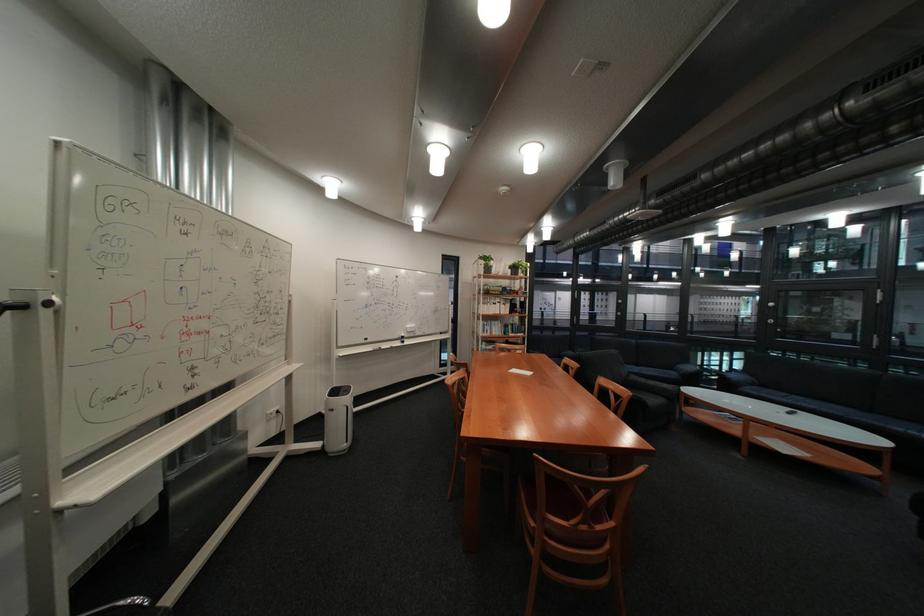
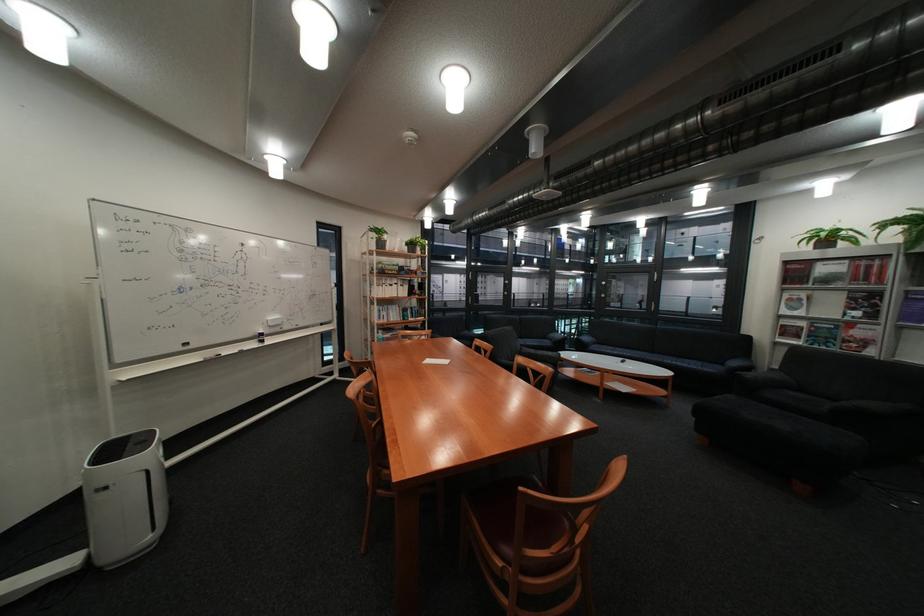
The point at (422, 326) is marked in the first image. Where is the corresponding point in the second image?

(284, 318)